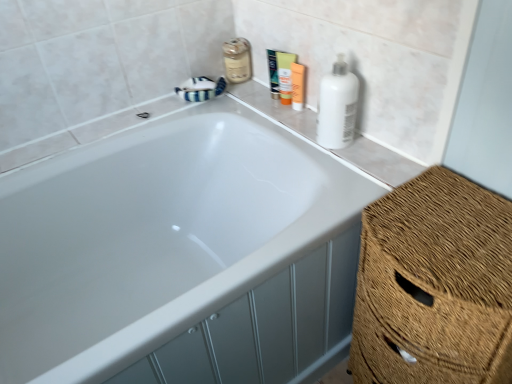
What is the approximate height of woven straw basket at right?

woven straw basket at right is 22.32 inches in height.

You are a GUI agent. You are given a task and a screenshot of the screen. Output one action in this format:
    pyautogui.click(x=<x>, y=<y>)
    Task: Click on the green plastic tube at upper center, which is the 3th toiletry in right-to-left order
    Image resolution: width=512 pixels, height=384 pixels.
    Given the screenshot: What is the action you would take?
    pyautogui.click(x=273, y=73)

At what (x,y) coordinates should I click in order to perform the action: click on matte orange tube at upper center, positioned as the second toiletry in right-to-left order. Please return your answer as a coordinate pair (x, y). Looking at the image, I should click on (285, 75).

Which object is wider, green plastic tube at upper center, which is the 3th toiletry in right-to-left order, or matte orange tube at upper center, the second toiletry when ordered from left to right?

matte orange tube at upper center, the second toiletry when ordered from left to right, is wider.

From the picture: Is green plastic tube at upper center, which is the 3th toiletry in right-to-left order, turned away from matte orange tube at upper center, positioned as the second toiletry in right-to-left order?

green plastic tube at upper center, which is the 3th toiletry in right-to-left order, is not turned away from matte orange tube at upper center, positioned as the second toiletry in right-to-left order.

Would you say green plastic tube at upper center, which is the 3th toiletry in right-to-left order, is outside matte orange tube at upper center, positioned as the second toiletry in right-to-left order?

Yes, green plastic tube at upper center, which is the 3th toiletry in right-to-left order, is located beyond the bounds of matte orange tube at upper center, positioned as the second toiletry in right-to-left order.

How different are the orientations of green plastic tube at upper center, positioned as the first toiletry in left-to-right order, and matte orange tube at upper center, the second toiletry when ordered from left to right, in degrees?

The angular difference between green plastic tube at upper center, positioned as the first toiletry in left-to-right order, and matte orange tube at upper center, the second toiletry when ordered from left to right, is 6.09 degrees.

From a real-world perspective, which object stands above the other?

white matte bottle at upper right.

Which is more to the left, white matte bottle at upper right or woven straw basket at right?

white matte bottle at upper right.

I want to click on basket on the right of white matte bottle at upper right, so tap(434, 285).

Who is taller, white matte bottle at upper right or woven straw basket at right?

Standing taller between the two is woven straw basket at right.

Is woven straw basket at right positioned before white matte bottle at upper right?

Yes, it is in front of white matte bottle at upper right.

You are a GUI agent. You are given a task and a screenshot of the screen. Output one action in this format:
    pyautogui.click(x=<x>, y=<y>)
    Task: Click on the basket below the white matte bottle at upper right (from the image's perspective)
    
    Given the screenshot: What is the action you would take?
    pyautogui.click(x=434, y=285)

Can you confirm if woven straw basket at right is taller than white matte bottle at upper right?

Yes, woven straw basket at right is taller than white matte bottle at upper right.

Is white glossy bathtub at upper center in contact with green plastic tube at upper center, which is the 3th toiletry in right-to-left order?

No, white glossy bathtub at upper center is not with green plastic tube at upper center, which is the 3th toiletry in right-to-left order.

Can you confirm if white glossy bathtub at upper center is shorter than green plastic tube at upper center, which is the 3th toiletry in right-to-left order?

No.

Between point (9, 252) and point (277, 74), which one is positioned in front?

The point (9, 252) is more forward.

Is the position of white glossy bathtub at upper center less distant than that of white matte bottle at upper right?

Yes, it is.

Is white glossy bathtub at upper center far from white matte bottle at upper right?

No.

Considering the positions of points (112, 278) and (348, 142), is point (112, 278) farther from camera compared to point (348, 142)?

That is True.

How different are the orientations of white glossy bathtub at upper center and white matte bottle at upper right in degrees?

They differ by 90 degrees in their facing directions.

Looking at the image, does matte glass mouthwash at upper center seem bigger or smaller compared to woven straw basket at right?

Clearly, matte glass mouthwash at upper center is smaller in size than woven straw basket at right.

Could you tell me if matte glass mouthwash at upper center is facing woven straw basket at right?

Yes, matte glass mouthwash at upper center faces towards woven straw basket at right.

Which is behind, matte glass mouthwash at upper center or woven straw basket at right?

matte glass mouthwash at upper center is more distant.

Considering the relative sizes of matte glass mouthwash at upper center and woven straw basket at right in the image provided, is matte glass mouthwash at upper center taller than woven straw basket at right?

In fact, matte glass mouthwash at upper center may be shorter than woven straw basket at right.

Considering the positions of objects woven straw basket at right and orange matte lotion at upper center, which is the 3th toiletry in left-to-right order, in the image provided, who is more to the left, woven straw basket at right or orange matte lotion at upper center, which is the 3th toiletry in left-to-right order,?

From the viewer's perspective, orange matte lotion at upper center, which is the 3th toiletry in left-to-right order, appears more on the left side.

From a real-world perspective, is woven straw basket at right below orange matte lotion at upper center, which is counted as the 1th toiletry, starting from the right?

Correct, in the physical world, woven straw basket at right is lower than orange matte lotion at upper center, which is counted as the 1th toiletry, starting from the right.

Are woven straw basket at right and orange matte lotion at upper center, which is counted as the 1th toiletry, starting from the right, located far from each other?

Actually, woven straw basket at right and orange matte lotion at upper center, which is counted as the 1th toiletry, starting from the right, are a little close together.

Identify the location of basket lying below the orange matte lotion at upper center, which is the 3th toiletry in left-to-right order (from the image's perspective). This screenshot has height=384, width=512. (434, 285).

This screenshot has height=384, width=512. There is a green plastic tube at upper center, positioned as the first toiletry in left-to-right order. What are the coordinates of `the 1st toiletry below it (from a real-world perspective)` in the screenshot? It's located at (285, 75).

The height and width of the screenshot is (384, 512). What are the coordinates of `cleaning product above the woven straw basket at right (from a real-world perspective)` in the screenshot? It's located at (337, 106).

Based on their spatial positions, is matte glass mouthwash at upper center or white glossy bathtub at upper center further from woven straw basket at right?

matte glass mouthwash at upper center.

Based on their spatial positions, is woven straw basket at right or matte glass mouthwash at upper center further from white glossy bathtub at upper center?

The object further to white glossy bathtub at upper center is matte glass mouthwash at upper center.

Looking at the image, which one is located further to green plastic tube at upper center, positioned as the first toiletry in left-to-right order, woven straw basket at right or white glossy bathtub at upper center?

Based on the image, woven straw basket at right appears to be further to green plastic tube at upper center, positioned as the first toiletry in left-to-right order.

Estimate the real-world distances between objects in this image. Which object is closer to matte orange tube at upper center, positioned as the second toiletry in right-to-left order, white glossy bathtub at upper center or orange matte lotion at upper center, which is the 3th toiletry in left-to-right order?

orange matte lotion at upper center, which is the 3th toiletry in left-to-right order, lies closer to matte orange tube at upper center, positioned as the second toiletry in right-to-left order, than the other object.

Based on their spatial positions, is woven straw basket at right or white matte bottle at upper right closer to matte orange tube at upper center, the second toiletry when ordered from left to right?

Based on the image, white matte bottle at upper right appears to be nearer to matte orange tube at upper center, the second toiletry when ordered from left to right.

When comparing their distances from white matte bottle at upper right, does white glossy bathtub at upper center or woven straw basket at right seem further?

white glossy bathtub at upper center lies further to white matte bottle at upper right than the other object.

When comparing their distances from white glossy bathtub at upper center, does orange matte lotion at upper center, which is the 3th toiletry in left-to-right order, or matte orange tube at upper center, positioned as the second toiletry in right-to-left order, seem further?

orange matte lotion at upper center, which is the 3th toiletry in left-to-right order.

Estimate the real-world distances between objects in this image. Which object is closer to matte orange tube at upper center, the second toiletry when ordered from left to right, white matte bottle at upper right or orange matte lotion at upper center, which is the 3th toiletry in left-to-right order?

orange matte lotion at upper center, which is the 3th toiletry in left-to-right order, lies closer to matte orange tube at upper center, the second toiletry when ordered from left to right, than the other object.

At what (x,y) coordinates should I click in order to perform the action: click on toiletry between white matte bottle at upper right and matte orange tube at upper center, positioned as the second toiletry in right-to-left order, from front to back. Please return your answer as a coordinate pair (x, y). Looking at the image, I should click on (297, 86).

Identify the location of cleaning product between white glossy bathtub at upper center and matte orange tube at upper center, the second toiletry when ordered from left to right, along the z-axis. (337, 106).

This screenshot has width=512, height=384. What are the coordinates of `toiletry between matte orange tube at upper center, positioned as the second toiletry in right-to-left order, and woven straw basket at right in the up-down direction` in the screenshot? It's located at (297, 86).

Image resolution: width=512 pixels, height=384 pixels. Find the location of `cleaning product positioned between white glossy bathtub at upper center and orange matte lotion at upper center, which is counted as the 1th toiletry, starting from the right, from near to far`. cleaning product positioned between white glossy bathtub at upper center and orange matte lotion at upper center, which is counted as the 1th toiletry, starting from the right, from near to far is located at coordinates (337, 106).